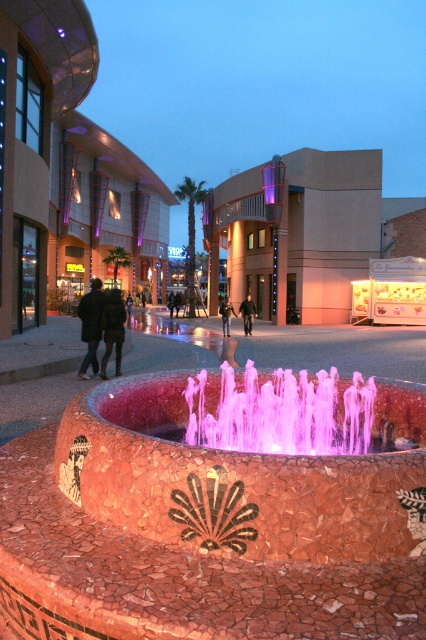
From the picture: You are a photographer standing in the plaza and want to take a picture of the pink mosaic fountain at center and the dark brown leather jacket at lower left. Can you capture both objects in the same frame without moving your position?

The pink mosaic fountain at center is in front of the dark brown leather jacket at lower left, so you can capture both in the same frame as long as the jacket is visible behind the fountain.

You are a store manager who needs to arrange two jackets for a window display. You have the dark green fabric jacket at left and the dark gray jacket at center. Which jacket should be placed on the lower shelf to match their sizes?

The dark green fabric jacket at left has a lesser height compared to the dark gray jacket at center, so it should be placed on the lower shelf to match their sizes.